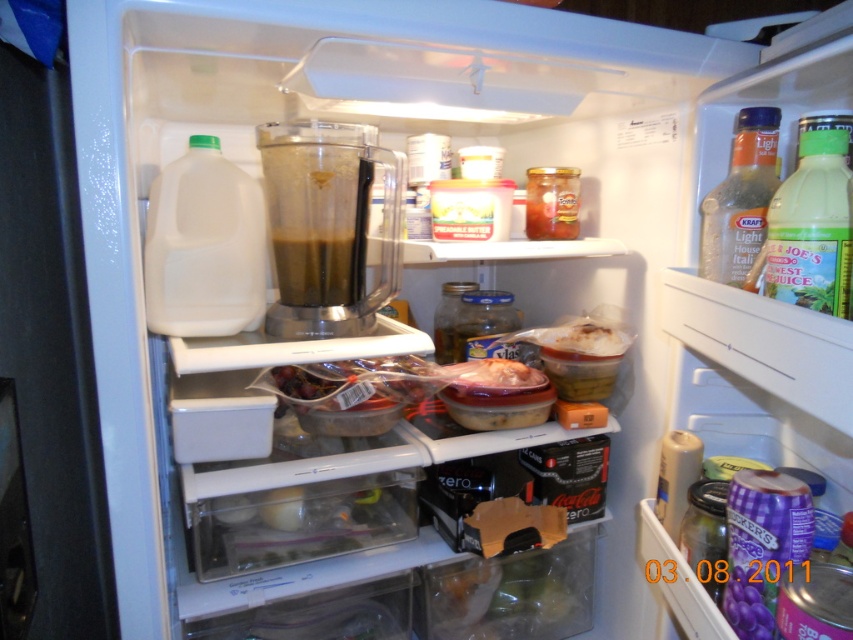
Which is above, white matte plastic milk at left or dark brown liquid at center?

Positioned higher is white matte plastic milk at left.

Can you confirm if white matte plastic milk at left is positioned to the left of dark brown liquid at center?

Indeed, white matte plastic milk at left is positioned on the left side of dark brown liquid at center.

This screenshot has height=640, width=853. What are the coordinates of `white matte plastic milk at left` in the screenshot? It's located at (204, 244).

Who is more forward, [740,196] or [349,269]?

Point [740,196] is more forward.

Does point (727, 252) come closer to viewer compared to point (315, 288)?

That is True.

Locate an element on the screen. This screenshot has height=640, width=853. translucent plastic bottle at upper right is located at coordinates (740, 198).

Which is above, white matte plastic milk at left or green plastic bottle at upper right?

white matte plastic milk at left

Can you confirm if white matte plastic milk at left is positioned to the right of green plastic bottle at upper right?

Incorrect, white matte plastic milk at left is not on the right side of green plastic bottle at upper right.

Image resolution: width=853 pixels, height=640 pixels. What do you see at coordinates (204, 244) in the screenshot?
I see `white matte plastic milk at left` at bounding box center [204, 244].

Where is `white matte plastic milk at left`? The width and height of the screenshot is (853, 640). white matte plastic milk at left is located at coordinates (204, 244).